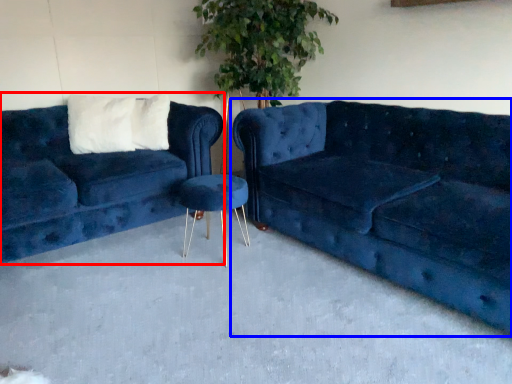
Question: Among these objects, which one is farthest to the camera, studio couch (highlighted by a red box) or studio couch (highlighted by a blue box)?

Choices:
 (A) studio couch
 (B) studio couch

Answer: (A)